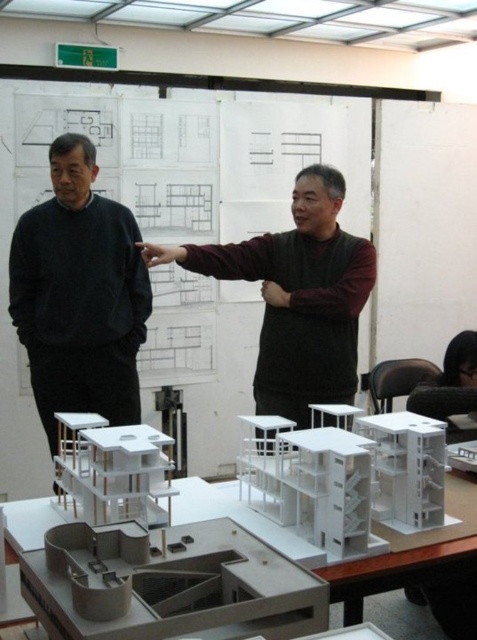
Question: Can you confirm if black matte sweater at left is positioned to the left of white matte table at center?

Choices:
 (A) no
 (B) yes

Answer: (B)

Question: Which of the following is the farthest from the observer?

Choices:
 (A) (474, 538)
 (B) (260, 348)
 (C) (71, 380)

Answer: (C)

Question: In this image, where is black matte sweater at left located relative to dark brown sweater at center?

Choices:
 (A) left
 (B) right

Answer: (A)

Question: Which object is the closest to the black matte sweater at left?

Choices:
 (A) dark brown sweater at center
 (B) white matte table at center

Answer: (A)

Question: Can you confirm if dark brown sweater at center is positioned below white matte table at center?

Choices:
 (A) yes
 (B) no

Answer: (B)

Question: Which of the following is the farthest from the observer?

Choices:
 (A) black matte sweater at left
 (B) dark brown sweater at center
 (C) white matte table at center

Answer: (A)